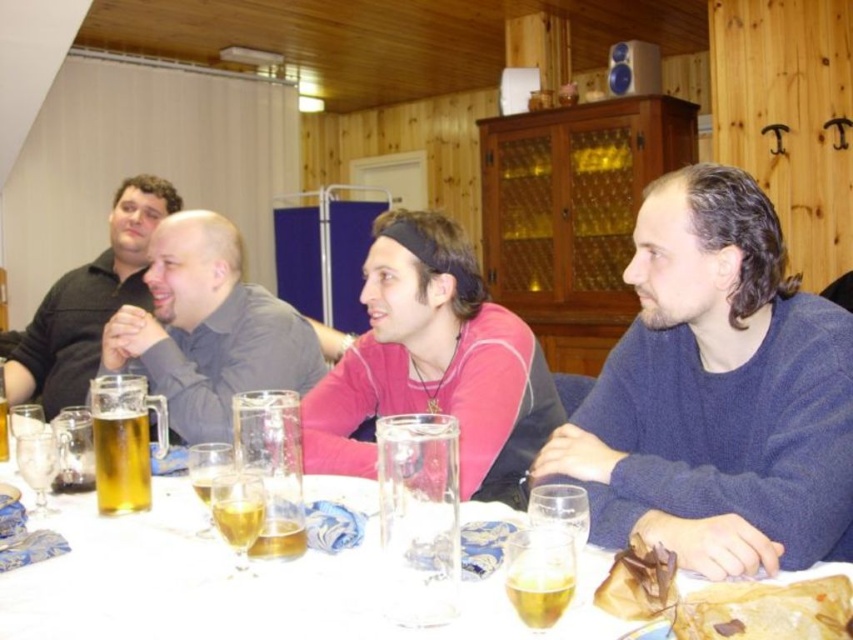
Question: Is clear glass water at center positioned behind golden translucent beer at table center?

Choices:
 (A) yes
 (B) no

Answer: (B)

Question: Which point appears closest to the camera in this image?

Choices:
 (A) (137, 429)
 (B) (675, 541)

Answer: (B)

Question: Does clear glass water at center appear under golden translucent beer at table center?

Choices:
 (A) no
 (B) yes

Answer: (B)

Question: Which point is closer to the camera taking this photo?

Choices:
 (A) [97, 422]
 (B) [419, 252]
 (C) [753, 273]

Answer: (A)

Question: Is matte black shirt at left bigger than golden translucent beer at table center?

Choices:
 (A) no
 (B) yes

Answer: (B)

Question: Which of these objects is positioned farthest from the dark blue sweater at center?

Choices:
 (A) matte black shirt at left
 (B) golden translucent beer at table center
 (C) clear glass water at center
 (D) gray matte shirt at center

Answer: (A)